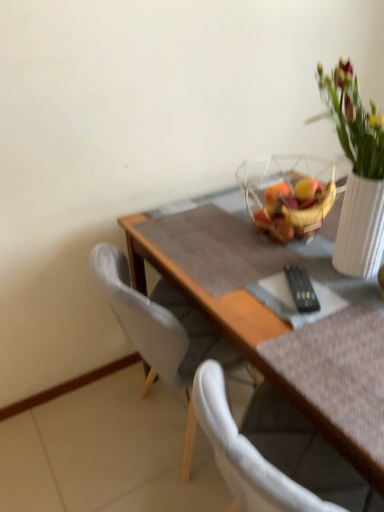
Question: In terms of size, does wooden table at center appear bigger or smaller than translucent glass bowl at upper center?

Choices:
 (A) big
 (B) small

Answer: (A)

Question: Is wooden table at center to the left or to the right of translucent glass bowl at upper center in the image?

Choices:
 (A) right
 (B) left

Answer: (A)

Question: Which of these objects is positioned closest to the white fabric chair at left?

Choices:
 (A) wooden table at center
 (B) transparent glass bowl at upper right
 (C) translucent glass bowl at upper center

Answer: (A)

Question: Which object is positioned closest to the translucent glass bowl at upper center?

Choices:
 (A) white fabric chair at left
 (B) wooden table at center
 (C) transparent glass bowl at upper right

Answer: (C)